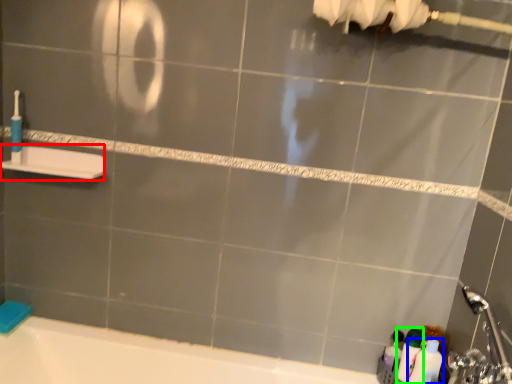
Question: Based on their relative distances, which object is nearer to towel bar (highlighted by a red box)? Choose from toiletry (highlighted by a blue box) and cleaning product (highlighted by a green box).

Choices:
 (A) toiletry
 (B) cleaning product

Answer: (B)